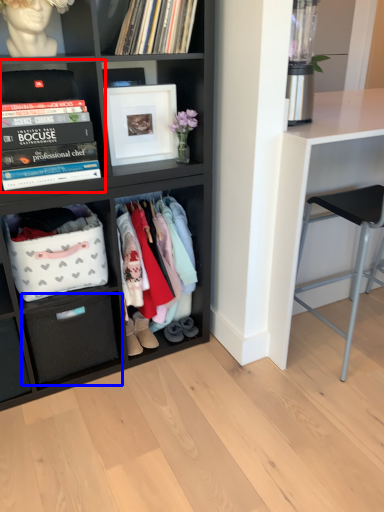
Question: Among these objects, which one is nearest to the camera, shelf (highlighted by a red box) or drawer (highlighted by a blue box)?

Choices:
 (A) shelf
 (B) drawer

Answer: (A)